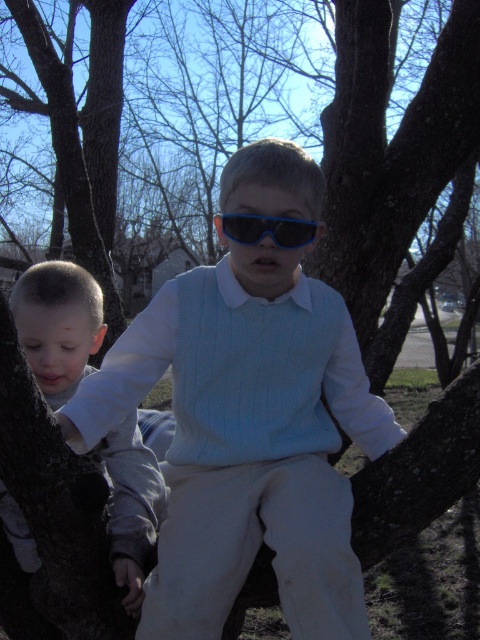
This screenshot has width=480, height=640. I want to click on blue plastic sunglasses at center, so click(x=249, y=419).

Which is behind, point (180, 378) or point (252, 220)?

Positioned behind is point (180, 378).

Find the location of `blue plastic sunglasses at center`. blue plastic sunglasses at center is located at coordinates (x=249, y=419).

Consider the image. How distant is blue plastic sunglasses at center from light gray fleece shirt at left?

The distance of blue plastic sunglasses at center from light gray fleece shirt at left is 25.55 centimeters.

Is blue plastic sunglasses at center above light gray fleece shirt at left?

Indeed, blue plastic sunglasses at center is positioned over light gray fleece shirt at left.

Between point (194, 544) and point (153, 452), which one is positioned behind?

Positioned behind is point (153, 452).

Find the location of `blue plastic sunglasses at center`. blue plastic sunglasses at center is located at coordinates (249, 419).

Is light gray fleece shirt at left wider than blue plastic goggles at center?

Correct, the width of light gray fleece shirt at left exceeds that of blue plastic goggles at center.

Identify the location of light gray fleece shirt at left. This screenshot has height=640, width=480. (58, 324).

The width and height of the screenshot is (480, 640). I want to click on light gray fleece shirt at left, so click(58, 324).